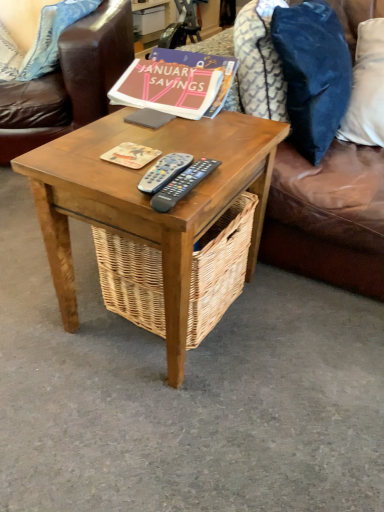
Image resolution: width=384 pixels, height=512 pixels. I want to click on vacant space that is in between wooden side table at center and brown leather couch at upper right, so click(x=284, y=330).